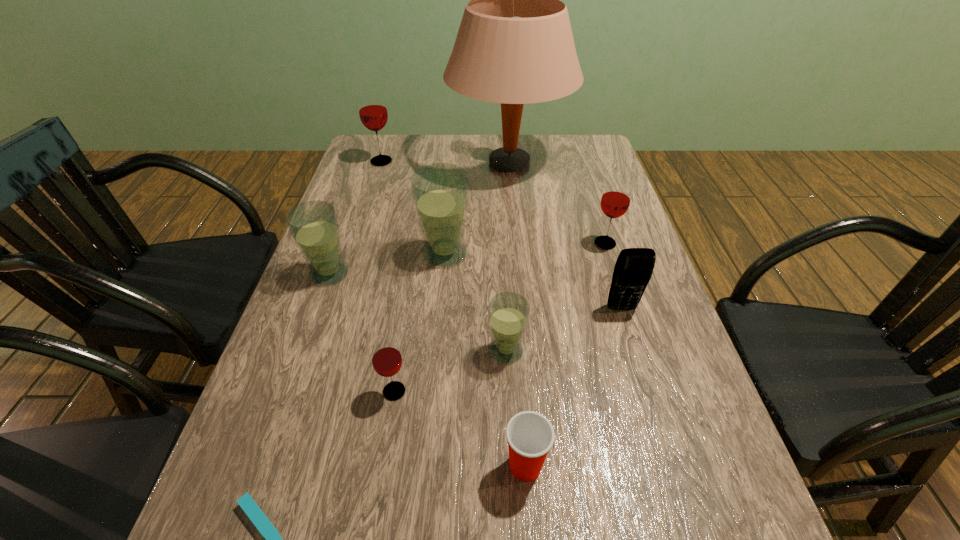
At what (x,y) coordinates should I click in order to perform the action: click on cellular telephone present at the right edge. Please return your answer as a coordinate pair (x, y). Image resolution: width=960 pixels, height=540 pixels. Looking at the image, I should click on (634, 266).

Where is `object that is positioned at the far left corner`? object that is positioned at the far left corner is located at coordinates (373, 113).

Find the location of a particular element. This screenshot has width=960, height=540. object located in the far right corner section of the desktop is located at coordinates (514, 46).

What are the coordinates of `vacant point at the far edge` in the screenshot? It's located at (482, 154).

The width and height of the screenshot is (960, 540). In the image, there is a desktop. Identify the location of free space at the left edge. (382, 231).

The height and width of the screenshot is (540, 960). I want to click on vacant area at the right edge of the desktop, so click(x=750, y=516).

The image size is (960, 540). In the image, there is a desktop. In order to click on vacant region at the far left corner in this screenshot , I will do `click(374, 145)`.

This screenshot has height=540, width=960. I want to click on vacant space at the far right corner of the desktop, so click(x=567, y=138).

Find the location of a particular element. empty location between the biggest red glass and the smallest red glass is located at coordinates (388, 276).

The height and width of the screenshot is (540, 960). I want to click on vacant area between the biggest red glass and the nearest glass, so click(388, 276).